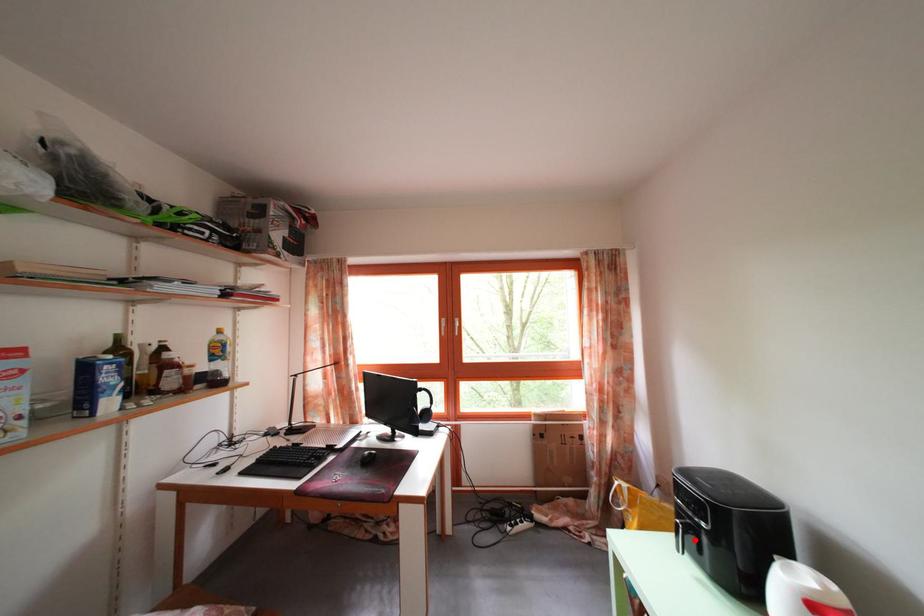
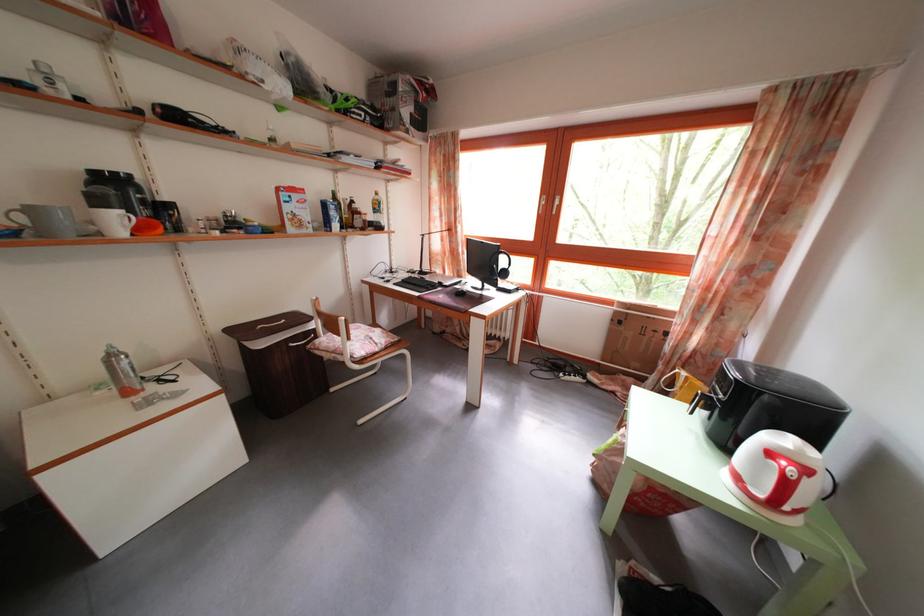
Find the pixel in the second image that matches the highlighted location in the first image.

(713, 411)